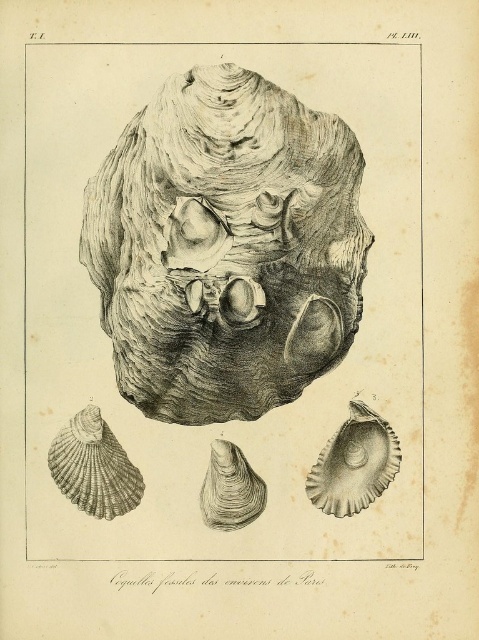
Does point (61, 429) come in front of point (215, 496)?

No, (61, 429) is behind (215, 496).

Does gray textured shell at lower left lie behind smooth gray oyster at center?

Yes, gray textured shell at lower left is behind smooth gray oyster at center.

Who is more forward, (101, 468) or (250, 467)?

Positioned in front is point (101, 468).

Identify the location of gray textured shell at lower left. This screenshot has height=640, width=479. (93, 467).

Can you confirm if smooth gray shell at lower right is taller than gray textured shell at lower left?

Yes, smooth gray shell at lower right is taller than gray textured shell at lower left.

Between smooth gray shell at lower right and gray textured shell at lower left, which one has less height?

Standing shorter between the two is gray textured shell at lower left.

Between point (341, 500) and point (105, 470), which one is positioned behind?

Point (341, 500)

Identify the location of smooth gray shell at lower right. The image size is (479, 640). (353, 464).

Who is more forward, (351, 506) or (232, 486)?

Point (232, 486) is more forward.

This screenshot has width=479, height=640. What do you see at coordinates (353, 464) in the screenshot?
I see `smooth gray shell at lower right` at bounding box center [353, 464].

The height and width of the screenshot is (640, 479). I want to click on smooth gray shell at lower right, so click(x=353, y=464).